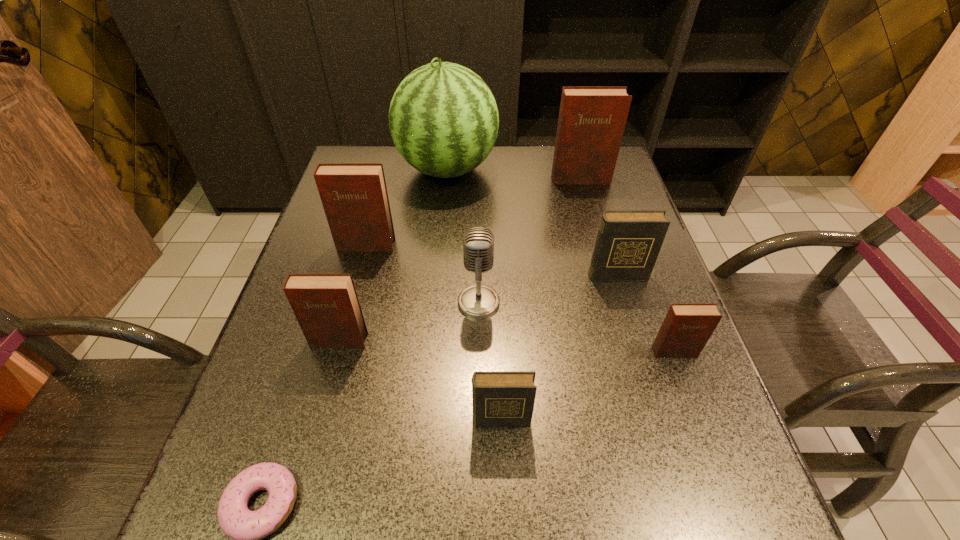
Point out which reddish-brown diary is positioned as the fourth nearest to the watermelon. Please provide its 2D coordinates. Your answer should be formatted as a tuple, i.e. [(x, y)], where the tuple contains the x and y coordinates of a point satisfying the conditions above.

[(686, 329)]

Identify the location of reddish-brown diary that can be found as the second closest to the third smallest reddish-brown diary. (592, 119).